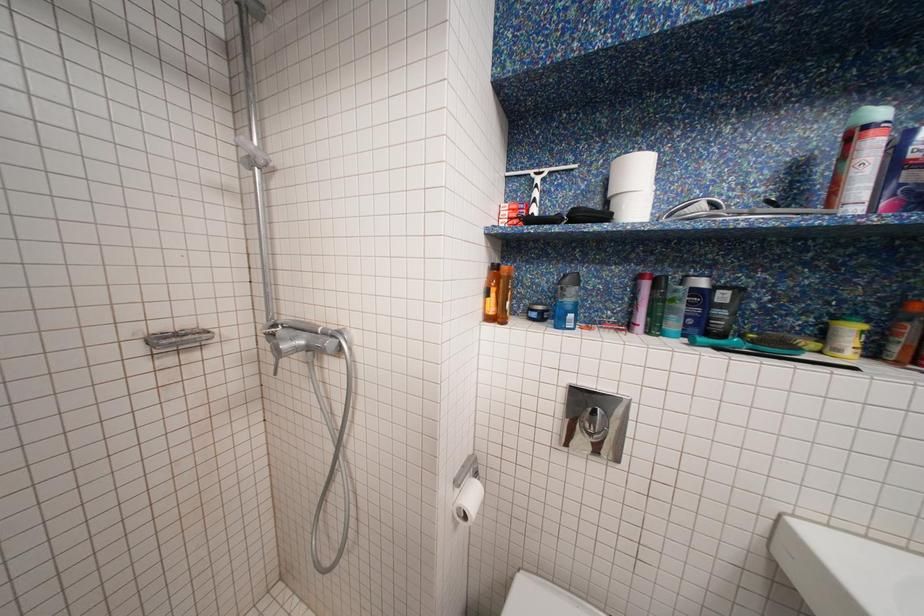
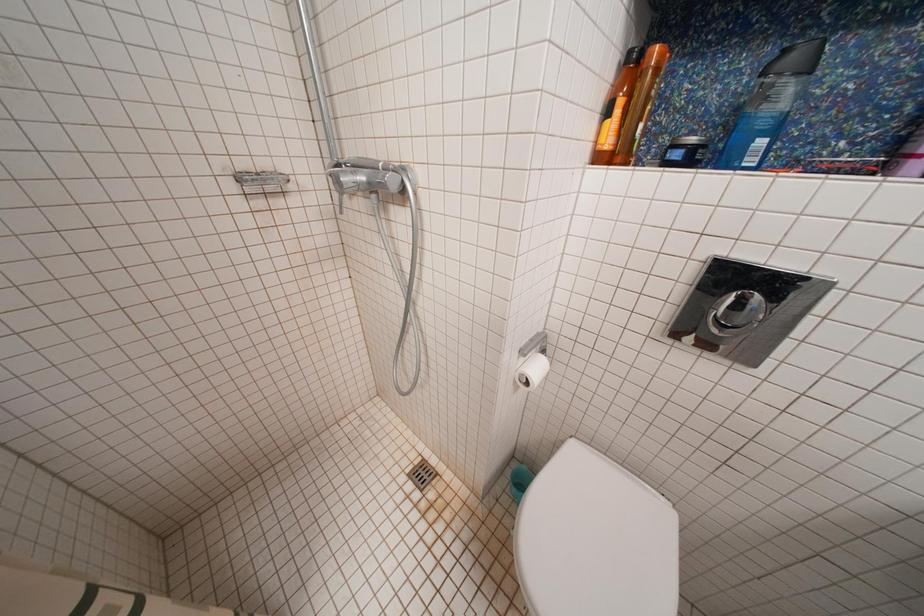
From the picture: First-person continuous shooting, in which direction is the camera rotating?

The rotation direction of the camera is left-down.